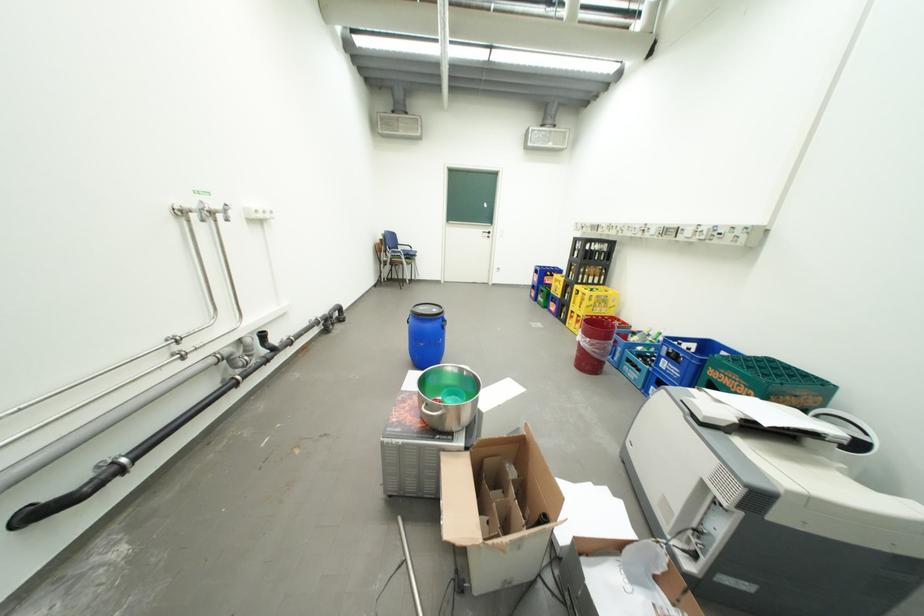
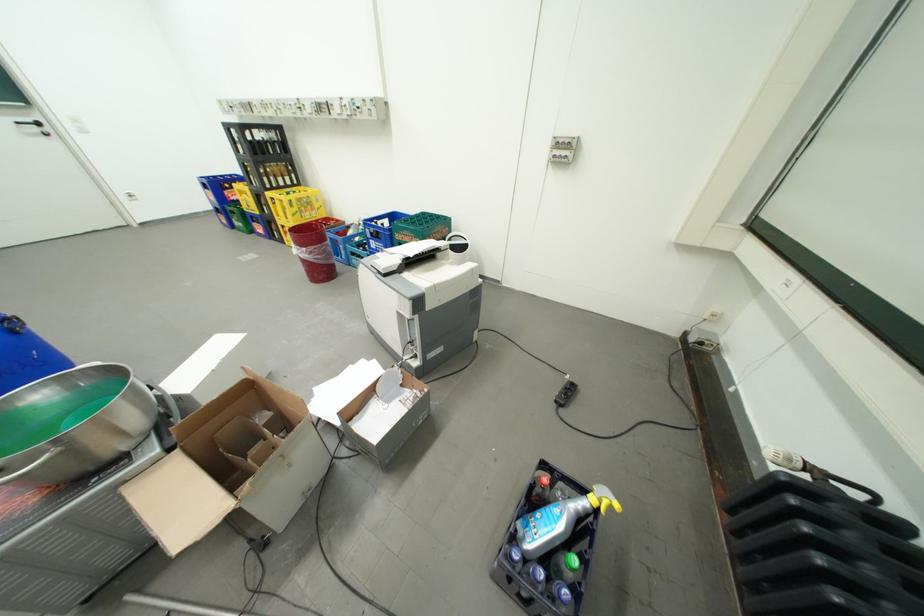
Locate, in the second image, the point that corresponds to pixel 480 371 in the first image.

(108, 365)